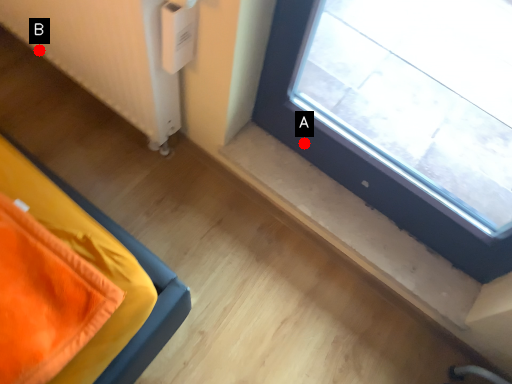
Question: Two points are circled on the image, labeled by A and B beside each circle. Which point appears farthest from the camera in this image?

Choices:
 (A) A is further
 (B) B is further

Answer: (B)